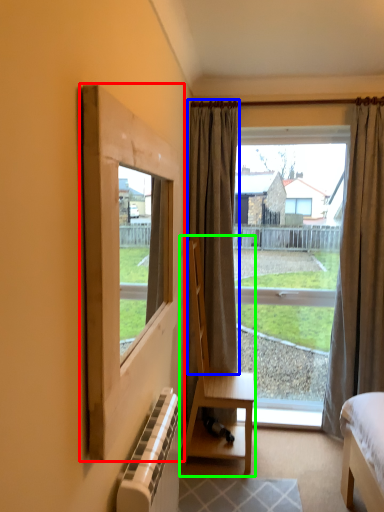
Question: Which is nearer to the window frame (highlighted by a red box)? curtain (highlighted by a blue box) or chair (highlighted by a green box).

Choices:
 (A) curtain
 (B) chair

Answer: (B)